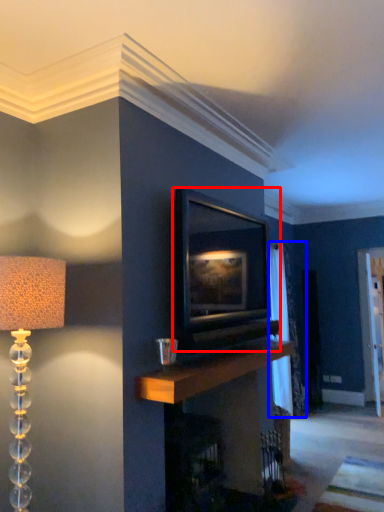
Question: Which point is further to the camera, picture frame (highlighted by a red box) or curtain (highlighted by a blue box)?

Choices:
 (A) picture frame
 (B) curtain

Answer: (B)